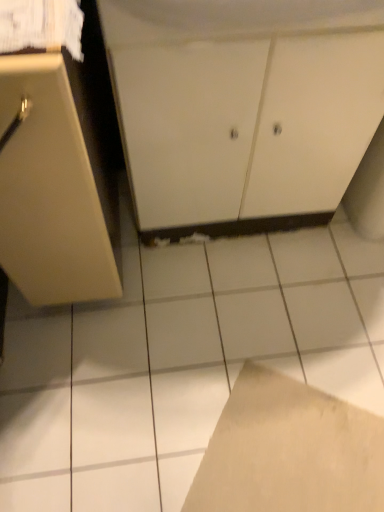
The width and height of the screenshot is (384, 512). I want to click on unoccupied region to the right of matte beige cabinet at left, which is counted as the 2th cabinetry, starting from the right, so click(203, 292).